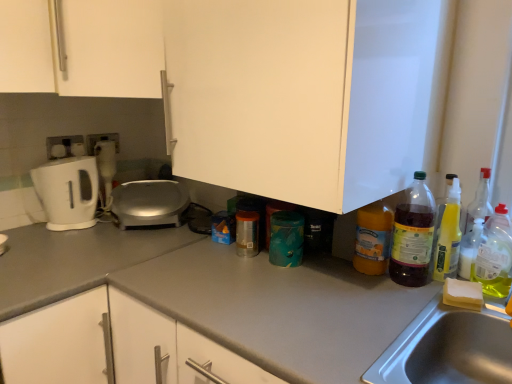
The width and height of the screenshot is (512, 384). What are the coordinates of `free area below white matte cabinet at center, which ranks as the first cabinetry in right-to-left order (from a real-world perspective)` in the screenshot? It's located at (272, 266).